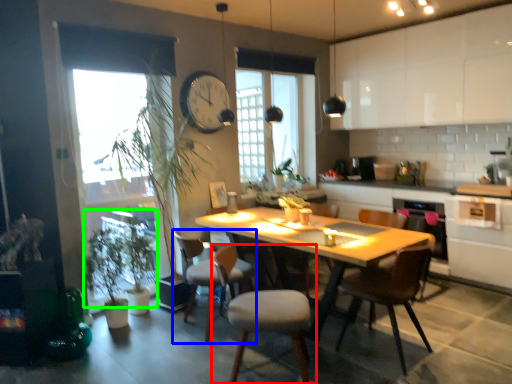
Question: Which is farther away from chair (highlighted by a red box)? chair (highlighted by a blue box) or plant (highlighted by a green box)?

Choices:
 (A) chair
 (B) plant

Answer: (B)